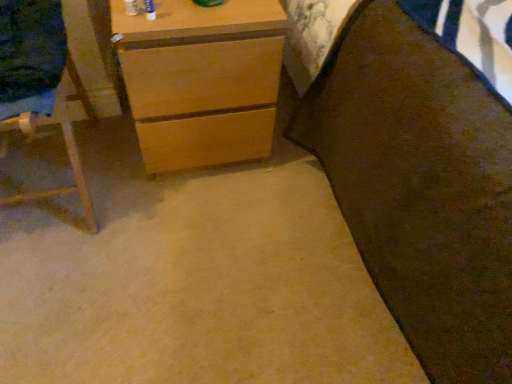
Question: Would you say brown fabric bed at right is outside wooden easel at left?

Choices:
 (A) no
 (B) yes

Answer: (B)

Question: Can you confirm if brown fabric bed at right is positioned to the left of wooden easel at left?

Choices:
 (A) no
 (B) yes

Answer: (A)

Question: Considering the relative sizes of brown fabric bed at right and wooden easel at left in the image provided, is brown fabric bed at right wider than wooden easel at left?

Choices:
 (A) no
 (B) yes

Answer: (B)

Question: Is brown fabric bed at right to the right of wooden easel at left from the viewer's perspective?

Choices:
 (A) no
 (B) yes

Answer: (B)

Question: Is brown fabric bed at right with wooden easel at left?

Choices:
 (A) yes
 (B) no

Answer: (B)

Question: Can you confirm if brown fabric bed at right is thinner than wooden easel at left?

Choices:
 (A) yes
 (B) no

Answer: (B)

Question: Is wooden easel at left inside light brown wood chest of drawers at upper left?

Choices:
 (A) no
 (B) yes

Answer: (A)

Question: From the image's perspective, is light brown wood chest of drawers at upper left beneath wooden easel at left?

Choices:
 (A) no
 (B) yes

Answer: (A)

Question: Does light brown wood chest of drawers at upper left appear on the right side of wooden easel at left?

Choices:
 (A) yes
 (B) no

Answer: (A)

Question: Is light brown wood chest of drawers at upper left with wooden easel at left?

Choices:
 (A) no
 (B) yes

Answer: (A)

Question: From a real-world perspective, is light brown wood chest of drawers at upper left physically below wooden easel at left?

Choices:
 (A) yes
 (B) no

Answer: (A)

Question: Can you confirm if light brown wood chest of drawers at upper left is smaller than wooden easel at left?

Choices:
 (A) no
 (B) yes

Answer: (A)

Question: Is brown fabric bed at right with light brown wood chest of drawers at upper left?

Choices:
 (A) yes
 (B) no

Answer: (B)